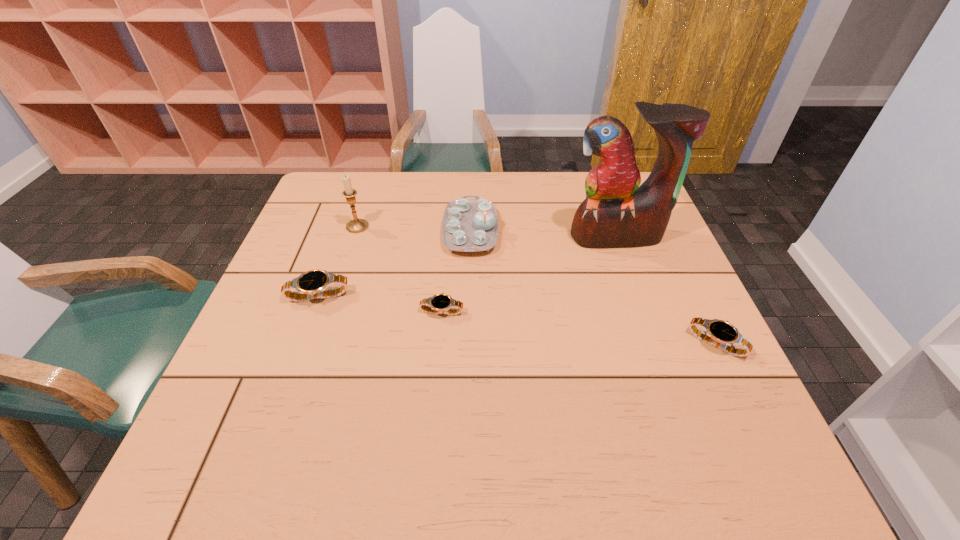
Identify the location of the tallest watch. (311, 285).

The height and width of the screenshot is (540, 960). I want to click on the leftmost watch, so click(311, 285).

Image resolution: width=960 pixels, height=540 pixels. Identify the location of the shortest watch. (439, 303).

Where is `the second watch from left to right`? The height and width of the screenshot is (540, 960). the second watch from left to right is located at coordinates (439, 303).

Locate an element on the screen. Image resolution: width=960 pixels, height=540 pixels. the second shortest watch is located at coordinates (721, 334).

Image resolution: width=960 pixels, height=540 pixels. In order to click on the nearest watch in this screenshot , I will do `click(721, 334)`.

At what (x,y) coordinates should I click in order to perform the action: click on chinaware. Please return your answer as a coordinate pair (x, y). Looking at the image, I should click on (469, 225).

The height and width of the screenshot is (540, 960). I want to click on the tallest object, so click(x=617, y=212).

You are a GUI agent. You are given a task and a screenshot of the screen. Output one action in this format:
    pyautogui.click(x=<x>, y=<y>)
    Task: Click on the candle holder
    
    Given the screenshot: What is the action you would take?
    pyautogui.click(x=356, y=225)

Where is `vacant region located on the front of the fourth tallest object`? vacant region located on the front of the fourth tallest object is located at coordinates point(283,392).